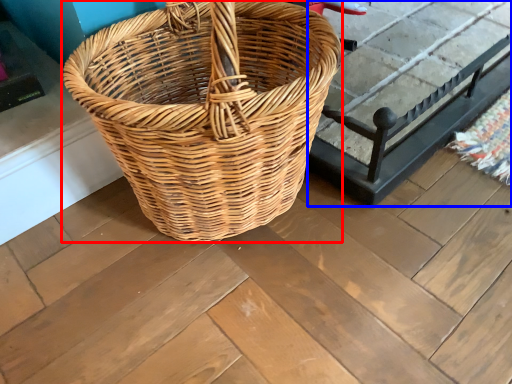
Question: Which object is further to the camera taking this photo, picnic basket (highlighted by a red box) or table (highlighted by a blue box)?

Choices:
 (A) picnic basket
 (B) table

Answer: (B)